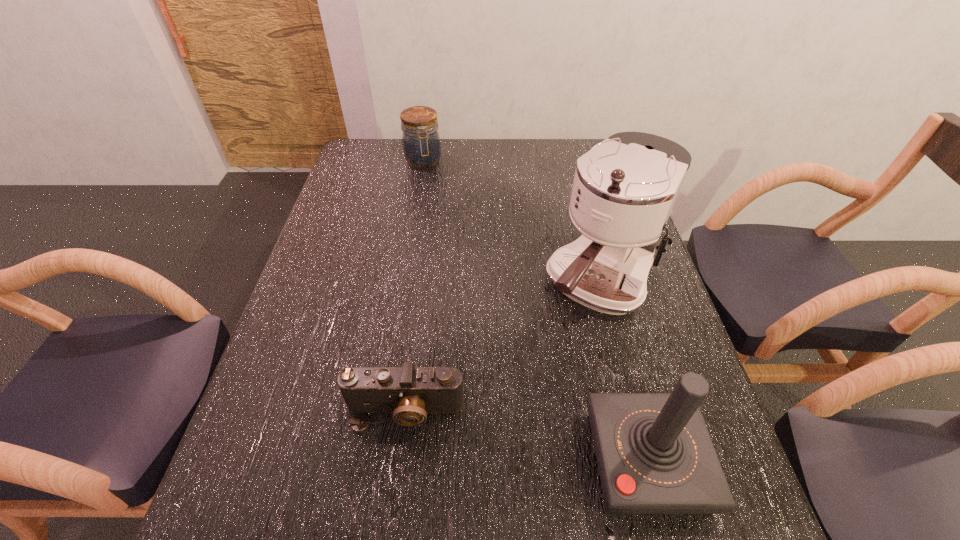
Locate an element on the screen. free spot on the desktop that is between the camera and the third shortest object and is positioned on the lid of the third tallest object is located at coordinates (491, 429).

Identify the location of free space on the desktop that is between the shortest object and the joystick and is positioned on the front-facing side of the coffee maker. (490, 429).